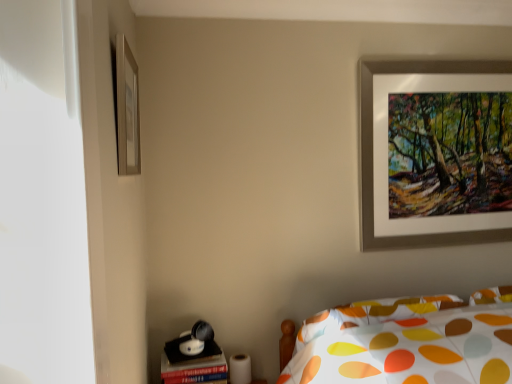
Question: Is silver metallic picture frame at upper left, positioned as the second picture frame in right-to-left order, surrounded by silver metallic picture frame at upper right, which is counted as the second picture frame, starting from the front?

Choices:
 (A) no
 (B) yes

Answer: (A)

Question: Does silver metallic picture frame at upper right, which ranks as the first picture frame in right-to-left order, have a larger size compared to silver metallic picture frame at upper left, marked as the 1th picture frame in a left-to-right arrangement?

Choices:
 (A) yes
 (B) no

Answer: (A)

Question: Is silver metallic picture frame at upper right, the 1th picture frame when ordered from back to front, to the left of silver metallic picture frame at upper left, positioned as the second picture frame in right-to-left order, from the viewer's perspective?

Choices:
 (A) no
 (B) yes

Answer: (A)

Question: Is silver metallic picture frame at upper right, which ranks as the first picture frame in right-to-left order, shorter than silver metallic picture frame at upper left, positioned as the second picture frame in right-to-left order?

Choices:
 (A) no
 (B) yes

Answer: (A)

Question: Can you confirm if silver metallic picture frame at upper right, the 1th picture frame when ordered from back to front, is taller than silver metallic picture frame at upper left, which ranks as the 2th picture frame in back-to-front order?

Choices:
 (A) no
 (B) yes

Answer: (B)

Question: Would you say silver metallic picture frame at upper right, which ranks as the first picture frame in right-to-left order, is to the left or to the right of silver metallic picture frame at upper left, which ranks as the 2th picture frame in back-to-front order, in the picture?

Choices:
 (A) left
 (B) right

Answer: (B)

Question: From the image's perspective, is silver metallic picture frame at upper right, the 1th picture frame when ordered from back to front, located above or below silver metallic picture frame at upper left, which ranks as the 2th picture frame in back-to-front order?

Choices:
 (A) above
 (B) below

Answer: (B)

Question: Based on their sizes in the image, would you say silver metallic picture frame at upper right, which is counted as the second picture frame, starting from the front, is bigger or smaller than silver metallic picture frame at upper left, positioned as the second picture frame in right-to-left order?

Choices:
 (A) big
 (B) small

Answer: (A)

Question: Is silver metallic picture frame at upper right, acting as the second picture frame starting from the left, in front of or behind silver metallic picture frame at upper left, positioned as the second picture frame in right-to-left order, in the image?

Choices:
 (A) behind
 (B) front

Answer: (A)

Question: Is silver metallic picture frame at upper right, the 1th picture frame when ordered from back to front, wider or thinner than matte black table at lower left?

Choices:
 (A) wide
 (B) thin

Answer: (B)

Question: From a real-world perspective, is silver metallic picture frame at upper right, which is counted as the second picture frame, starting from the front, physically located above or below matte black table at lower left?

Choices:
 (A) below
 (B) above

Answer: (B)

Question: From the image's perspective, is silver metallic picture frame at upper right, which is counted as the second picture frame, starting from the front, located above or below matte black table at lower left?

Choices:
 (A) below
 (B) above

Answer: (B)

Question: Considering the positions of silver metallic picture frame at upper right, the 1th picture frame when ordered from back to front, and matte black table at lower left in the image, is silver metallic picture frame at upper right, the 1th picture frame when ordered from back to front, bigger or smaller than matte black table at lower left?

Choices:
 (A) small
 (B) big

Answer: (B)

Question: Do you think silver metallic picture frame at upper left, marked as the 1th picture frame in a left-to-right arrangement, is within matte black table at lower left, or outside of it?

Choices:
 (A) inside
 (B) outside

Answer: (B)

Question: Is silver metallic picture frame at upper left, marked as the 1th picture frame in a left-to-right arrangement, wider or thinner than matte black table at lower left?

Choices:
 (A) thin
 (B) wide

Answer: (A)